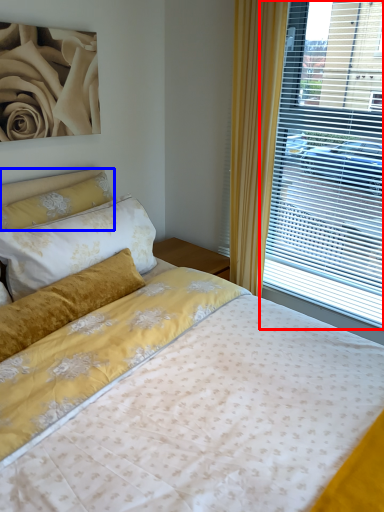
Question: Which of the following is the farthest to the observer, window (highlighted by a red box) or pillow (highlighted by a blue box)?

Choices:
 (A) window
 (B) pillow

Answer: (B)